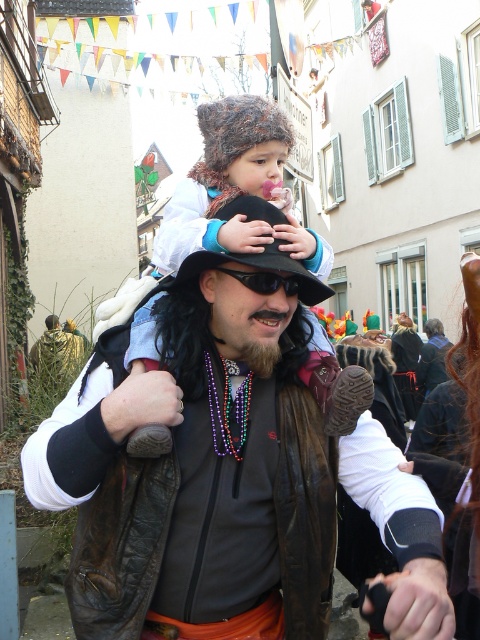
Is fluffy brown hat at center below black plastic goggles at center?

Incorrect, fluffy brown hat at center is not positioned below black plastic goggles at center.

Which is more to the right, fluffy brown hat at center or black plastic goggles at center?

black plastic goggles at center

Locate an element on the screen. The width and height of the screenshot is (480, 640). fluffy brown hat at center is located at coordinates (237, 188).

Between brown leather jacket at center and black plastic goggles at center, which one appears on the right side from the viewer's perspective?

black plastic goggles at center is more to the right.

Which is more to the left, brown leather jacket at center or black plastic goggles at center?

Positioned to the left is brown leather jacket at center.

This screenshot has width=480, height=640. I want to click on brown leather jacket at center, so click(x=224, y=477).

Which of these two, brown leather jacket at center or fluffy brown hat at center, stands shorter?

Standing shorter between the two is brown leather jacket at center.

Can you confirm if brown leather jacket at center is positioned above fluffy brown hat at center?

Incorrect, brown leather jacket at center is not positioned above fluffy brown hat at center.

Does point (319, 480) come farther from viewer compared to point (154, 248)?

No, (319, 480) is in front of (154, 248).

What are the coordinates of `brown leather jacket at center` in the screenshot? It's located at pos(224,477).